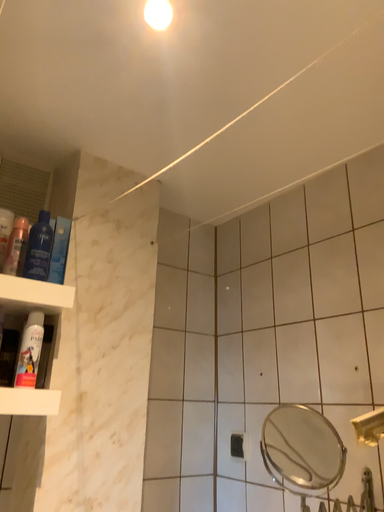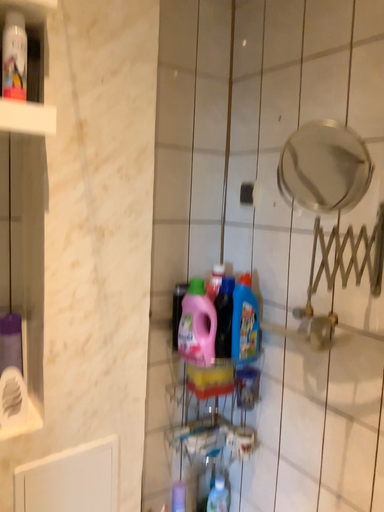
Question: Which way did the camera rotate in the video?

Choices:
 (A) rotated upward
 (B) rotated downward

Answer: (B)